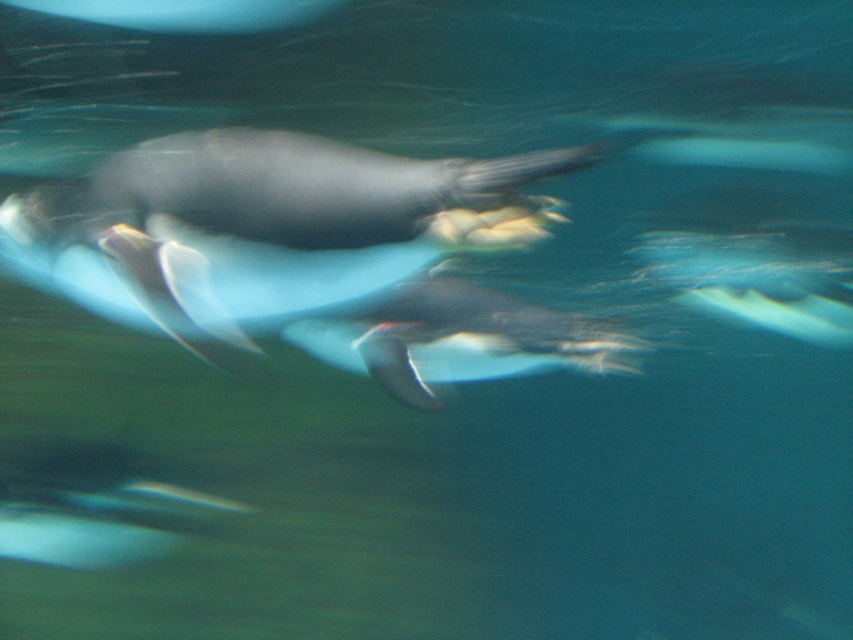
Can you confirm if white glossy penguin at center is positioned below white matte penguin at center?

No.

Which is in front, point (73, 294) or point (329, 362)?

Point (73, 294) is more forward.

Is point (238, 195) positioned behind point (525, 339)?

No, (238, 195) is closer to viewer.

Identify the location of white glossy penguin at center. The width and height of the screenshot is (853, 640). (264, 228).

Is white glossy penguin at center positioned behind black matte penguin at lower left?

No, white glossy penguin at center is closer to the viewer.

Image resolution: width=853 pixels, height=640 pixels. Identify the location of white glossy penguin at center. (264, 228).

Is point (96, 218) positioned before point (210, 508)?

Yes.

You are a GUI agent. You are given a task and a screenshot of the screen. Output one action in this format:
    pyautogui.click(x=<x>, y=<y>)
    Task: Click on the white glossy penguin at center
    This screenshot has width=853, height=640.
    Given the screenshot: What is the action you would take?
    pyautogui.click(x=264, y=228)

Looking at this image, is the position of white matte penguin at center less distant than that of black matte penguin at lower left?

Yes, it is in front of black matte penguin at lower left.

In the scene shown: Between white matte penguin at center and black matte penguin at lower left, which one is positioned lower?

Positioned lower is black matte penguin at lower left.

At what (x,y) coordinates should I click in order to perform the action: click on white matte penguin at center. Please return your answer as a coordinate pair (x, y). The height and width of the screenshot is (640, 853). Looking at the image, I should click on (457, 339).

Where is `white matte penguin at center`? The height and width of the screenshot is (640, 853). white matte penguin at center is located at coordinates (457, 339).